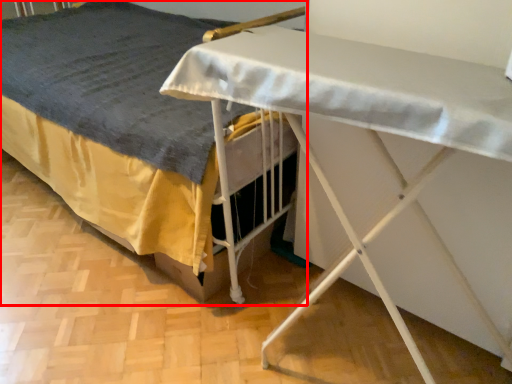
Question: From the image's perspective, what is the correct spatial relationship of bed (annotated by the red box) in relation to table?

Choices:
 (A) above
 (B) below

Answer: (A)